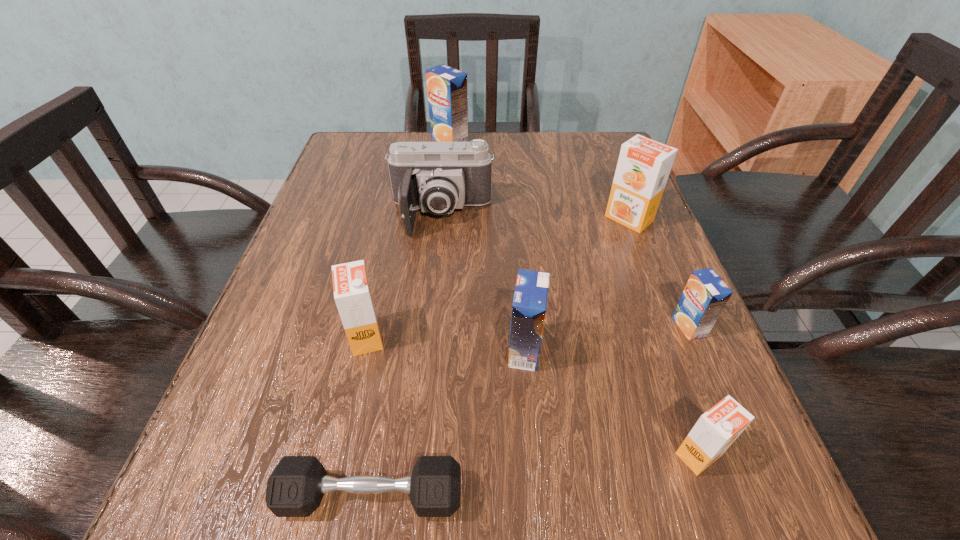
Image resolution: width=960 pixels, height=540 pixels. Find the location of `free space that satisfies the following two spatial constraints: 1. at the front of the fourth object from right to left with an open lens cover; 2. on the right side of the camera`. free space that satisfies the following two spatial constraints: 1. at the front of the fourth object from right to left with an open lens cover; 2. on the right side of the camera is located at coordinates (428, 351).

Where is `vacant space that satisfies the following two spatial constraints: 1. on the back side of the rightmost blue orange_juice; 2. on the left side of the nearest orange orange juice`? The width and height of the screenshot is (960, 540). vacant space that satisfies the following two spatial constraints: 1. on the back side of the rightmost blue orange_juice; 2. on the left side of the nearest orange orange juice is located at coordinates (654, 327).

Locate an element on the screen. The image size is (960, 540). blank space that satisfies the following two spatial constraints: 1. on the front side of the smallest blue orange_juice; 2. on the left side of the biggest orange orange juice is located at coordinates (671, 327).

Where is `vacant space that satisfies the following two spatial constraints: 1. on the back side of the fifth nearest orange_juice; 2. on the left side of the shortest object`? The width and height of the screenshot is (960, 540). vacant space that satisfies the following two spatial constraints: 1. on the back side of the fifth nearest orange_juice; 2. on the left side of the shortest object is located at coordinates (417, 219).